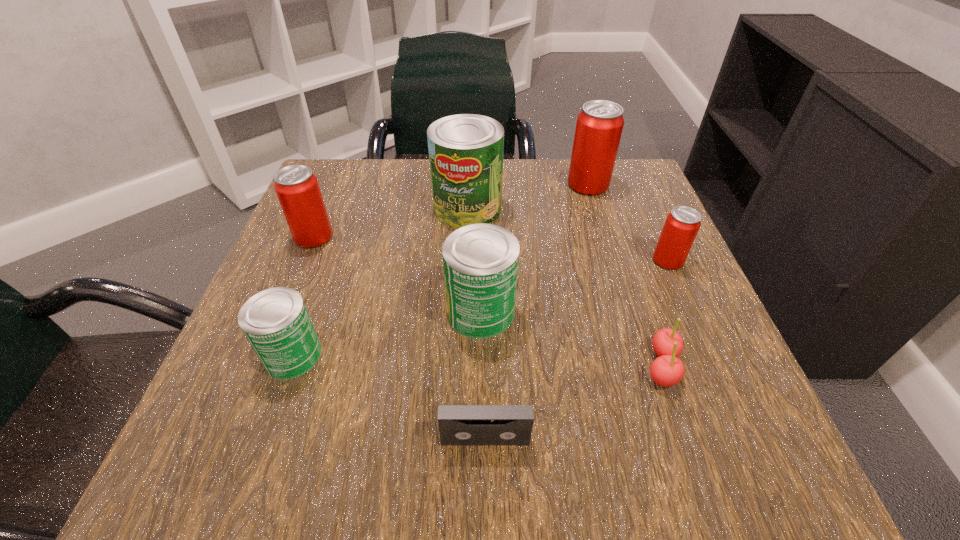
You are a GUI agent. You are given a task and a screenshot of the screen. Output one action in this format:
    pyautogui.click(x=<x>, y=<y>)
    Task: Click on the object that is positioned at the far right corner
    The image size is (960, 540).
    Given the screenshot: What is the action you would take?
    pyautogui.click(x=599, y=126)

This screenshot has width=960, height=540. I want to click on vacant area at the far edge of the desktop, so click(x=392, y=174).

At what (x,y) coordinates should I click in order to perform the action: click on vacant space at the near edge of the desktop. Please return your answer as a coordinate pair (x, y). Looking at the image, I should click on (471, 461).

The image size is (960, 540). Identify the location of blank space at the left edge of the desktop. (280, 250).

I want to click on free location at the right edge, so click(713, 374).

Locate an element on the screen. The height and width of the screenshot is (540, 960). vacant space at the far left corner of the desktop is located at coordinates (333, 210).

This screenshot has height=540, width=960. In the image, there is a desktop. In order to click on free space at the near left corner in this screenshot , I will do `click(292, 468)`.

In order to click on free point at the far right corner in this screenshot , I will do `click(621, 212)`.

I want to click on free space at the near right corner of the desktop, so click(x=653, y=434).

Image resolution: width=960 pixels, height=540 pixels. Identify the location of vacant point located between the second nearest red can and the biggest green can. (391, 222).